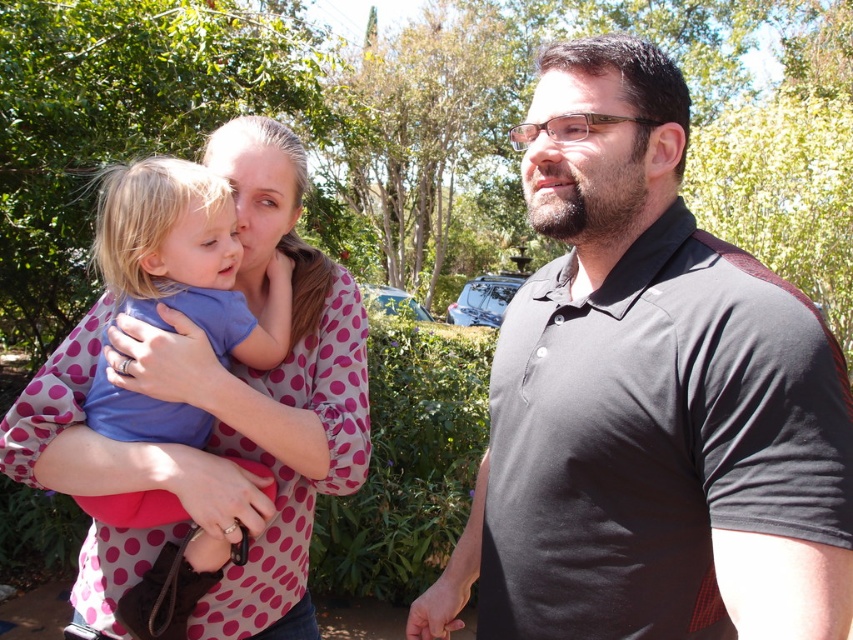
You are a photographer trying to capture a candid shot of both the black smooth polo shirt at right and the pink polka dot blouse at upper left. Which one should you focus on first to ensure both are in clear focus?

You should focus on the black smooth polo shirt at right first since it is closer to the viewer than the pink polka dot blouse at upper left. By focusing on the closer object, the background object will still be in acceptable focus due to depth of field principles.